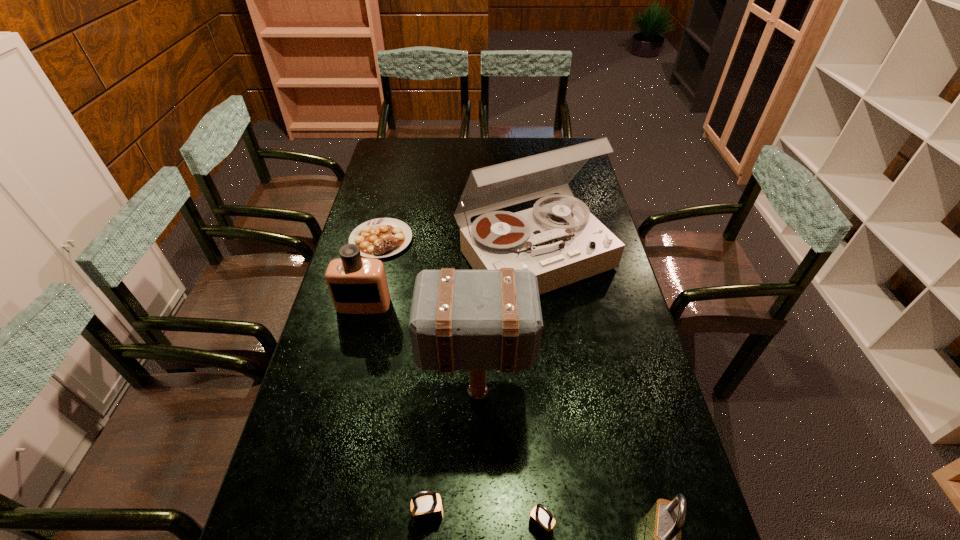
This screenshot has height=540, width=960. In order to click on the second tallest padlock in this screenshot , I will do `click(428, 508)`.

This screenshot has height=540, width=960. I want to click on the third shortest object, so click(428, 508).

Image resolution: width=960 pixels, height=540 pixels. In order to click on the second shortest object in this screenshot , I will do `click(541, 518)`.

The height and width of the screenshot is (540, 960). What are the coordinates of `the second padlock from left to right` in the screenshot? It's located at (541, 518).

The height and width of the screenshot is (540, 960). Identify the location of record player. (561, 242).

The height and width of the screenshot is (540, 960). Find the location of `steak`. steak is located at coordinates (378, 238).

The image size is (960, 540). I want to click on perfume, so click(357, 285).

Find the location of `the fourth nearest object`. the fourth nearest object is located at coordinates click(x=477, y=320).

You are a GUI agent. You are given a task and a screenshot of the screen. Output one action in this format:
    pyautogui.click(x=<x>, y=<y>)
    Task: Click on the vacant space situated 0.340m on the right of the fifth tallest object
    
    Given the screenshot: What is the action you would take?
    pyautogui.click(x=602, y=515)

At what (x,y) coordinates should I click in order to perform the action: click on free space located 0.280m on the left of the second padlock from left to right. Please return your answer as a coordinate pair (x, y). Image resolution: width=960 pixels, height=540 pixels. Looking at the image, I should click on (396, 525).